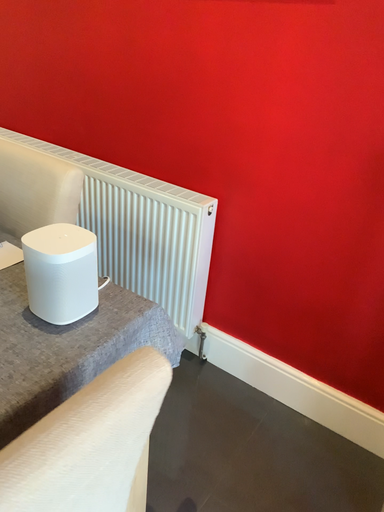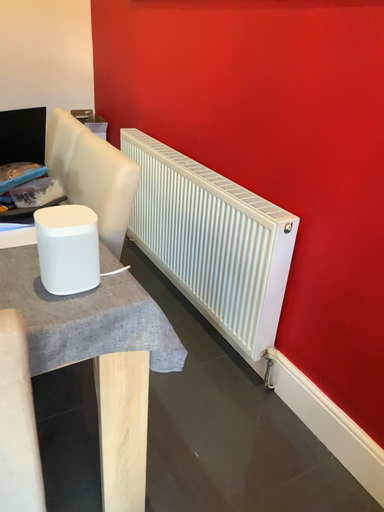
Question: Which way did the camera rotate in the video?

Choices:
 (A) rotated left
 (B) rotated right

Answer: (A)